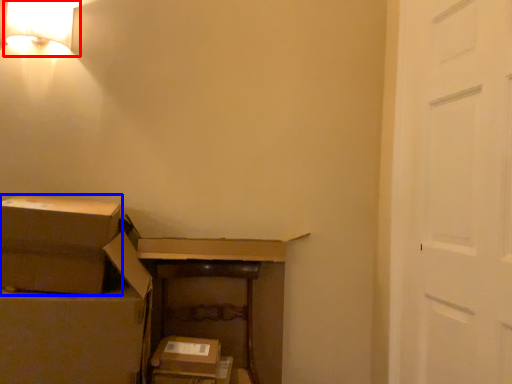
Question: Among these objects, which one is nearest to the camera, lamp (highlighted by a red box) or box (highlighted by a blue box)?

Choices:
 (A) lamp
 (B) box

Answer: (B)